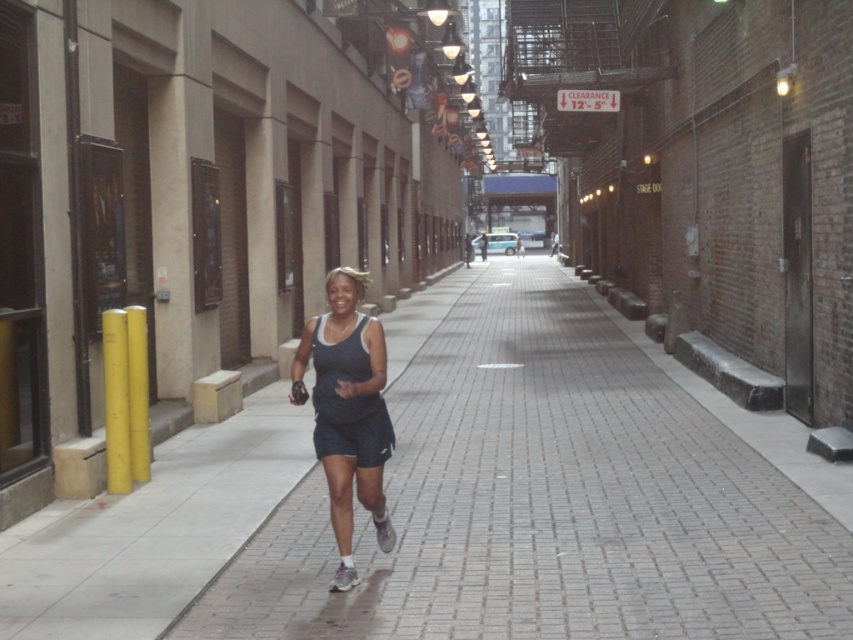
Question: Which point is farther to the camera?

Choices:
 (A) brick pavement at center
 (B) dark blue fabric tank top at center

Answer: (B)

Question: Does brick pavement at center lie behind dark blue fabric tank top at center?

Choices:
 (A) no
 (B) yes

Answer: (A)

Question: Does brick pavement at center appear under dark blue fabric tank top at center?

Choices:
 (A) yes
 (B) no

Answer: (A)

Question: Which point appears farthest from the camera in this image?

Choices:
 (A) (720, 573)
 (B) (351, 518)

Answer: (A)

Question: Is brick pavement at center wider than dark blue fabric tank top at center?

Choices:
 (A) no
 (B) yes

Answer: (B)

Question: Which object is closer to the camera taking this photo?

Choices:
 (A) brick pavement at center
 (B) dark blue fabric tank top at center

Answer: (A)